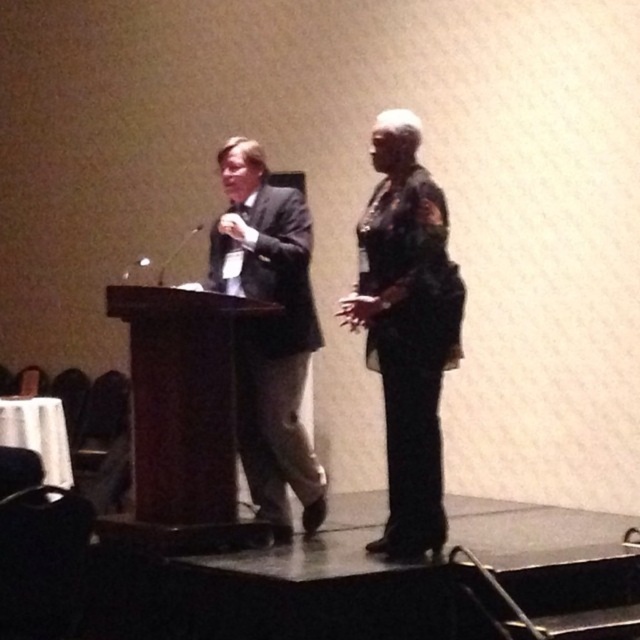
Question: Which object is closer to the camera taking this photo?

Choices:
 (A) dark gray suit at center
 (B) brown wood podium at center
 (C) dark green textured blazer at center

Answer: (C)

Question: Is dark green textured blazer at center below brown wood podium at center?

Choices:
 (A) yes
 (B) no

Answer: (B)

Question: Which object is the closest to the brown wood podium at center?

Choices:
 (A) dark green textured blazer at center
 (B) dark gray suit at center
 (C) metallic silver microphone at center

Answer: (B)

Question: Can you confirm if dark green textured blazer at center is positioned above metallic silver microphone at center?

Choices:
 (A) no
 (B) yes

Answer: (A)

Question: Is dark gray suit at center to the left of metallic silver microphone at center from the viewer's perspective?

Choices:
 (A) no
 (B) yes

Answer: (A)

Question: Which of the following is the closest to the observer?

Choices:
 (A) dark green textured blazer at center
 (B) dark gray suit at center
 (C) metallic silver microphone at center

Answer: (A)